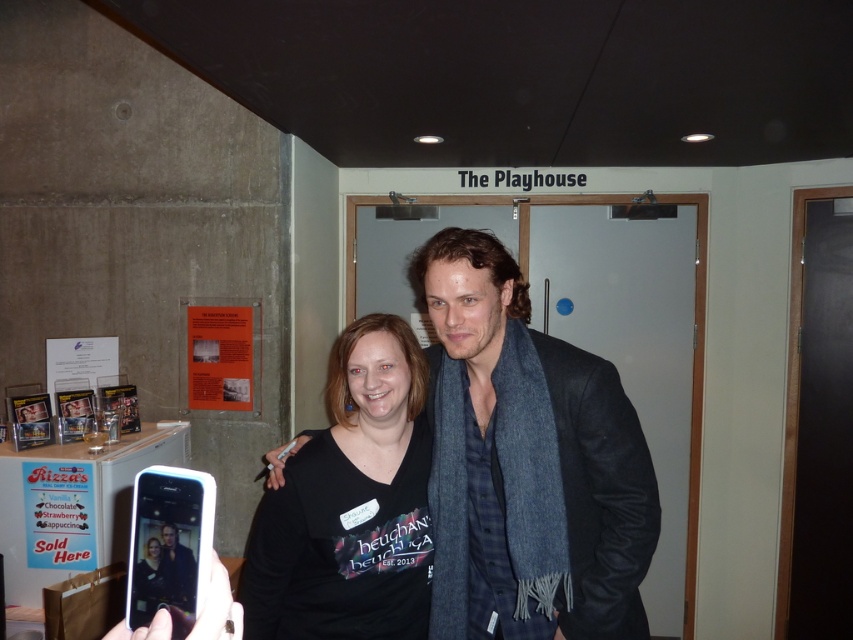
You are a photographer holding a camera. You want to take a photo of the dark gray wool scarf at center without any obstructions. Is the camera close enough to capture the scarf clearly?

The dark gray wool scarf at center and camera are 1.39 meters apart. Since the distance is within a typical camera focus range, the camera is close enough to capture the scarf clearly without obstructions.

You are a photographer trying to capture a closeup of the dark gray wool scarf at center and the black matte shirt at center in the image. Based on their widths, which object should you zoom in on first to ensure both fit in the frame?

The dark gray wool scarf at center might be wider than the black matte shirt at center, so you should zoom in on the dark gray wool scarf at center first to ensure it fits in the frame before adjusting for the narrower black matte shirt at center.

You are standing in the room and want to point to the exact location of the point at coordinates (526, 464). Which object is this point located on?

The point at coordinates (526, 464) is located on the dark gray wool scarf at center.